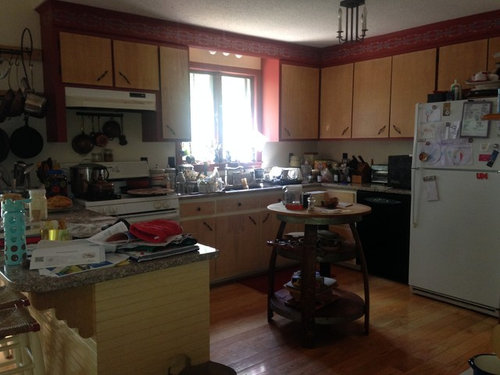
At what (x,y) coordinates should I click in order to perform the action: click on table. Please return your answer as a coordinate pair (x, y). Looking at the image, I should click on (331, 219).